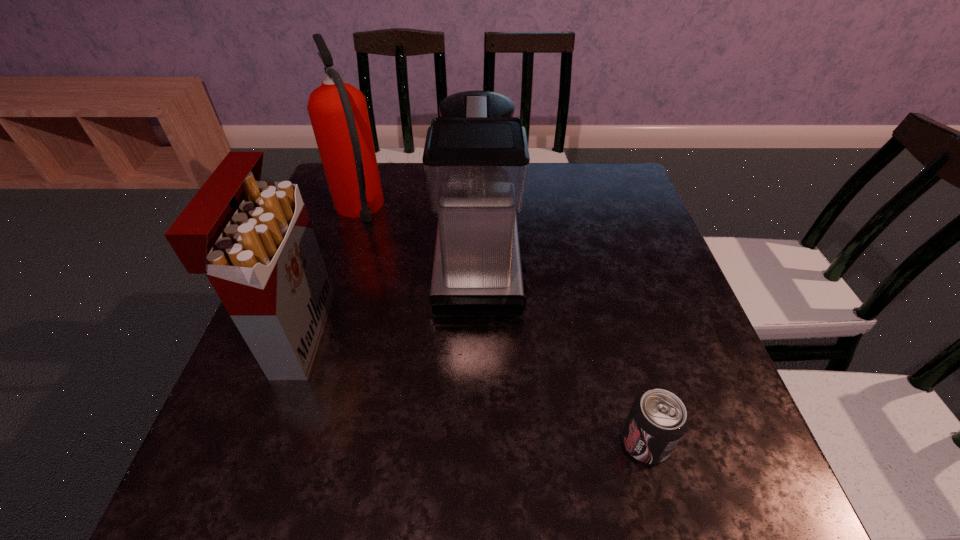
In the image, there is a desktop. At what (x,y) coordinates should I click in order to perform the action: click on vacant space at the left edge. Please return your answer as a coordinate pair (x, y). Looking at the image, I should click on (327, 222).

In the image, there is a desktop. Where is `vacant space at the right edge`? Image resolution: width=960 pixels, height=540 pixels. vacant space at the right edge is located at coordinates (655, 226).

This screenshot has width=960, height=540. I want to click on free space at the near left corner of the desktop, so click(199, 490).

Where is `vacant area at the far right corner`? This screenshot has width=960, height=540. vacant area at the far right corner is located at coordinates (618, 202).

Where is `blank region between the nearest object and the fire extinguisher`? blank region between the nearest object and the fire extinguisher is located at coordinates (502, 326).

The height and width of the screenshot is (540, 960). In order to click on unoccupied position between the coffee maker and the nearest object in this screenshot , I will do `click(562, 353)`.

This screenshot has width=960, height=540. Identify the location of empty space that is in between the coffee maker and the cigarette case. (389, 299).

Locate an element on the screen. The height and width of the screenshot is (540, 960). free space between the third object from left to right and the cigarette case is located at coordinates coord(389,299).

Image resolution: width=960 pixels, height=540 pixels. What are the coordinates of `free point between the fire extinguisher and the second object from right to left` in the screenshot? It's located at (419, 237).

Where is `vacant area that lies between the fire extinguisher and the nearest object`? The width and height of the screenshot is (960, 540). vacant area that lies between the fire extinguisher and the nearest object is located at coordinates (502, 326).